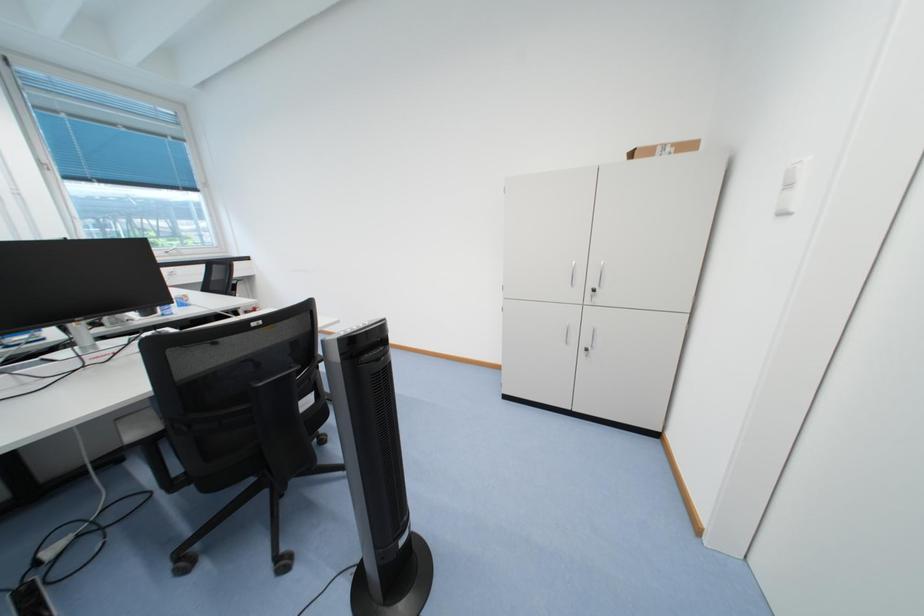
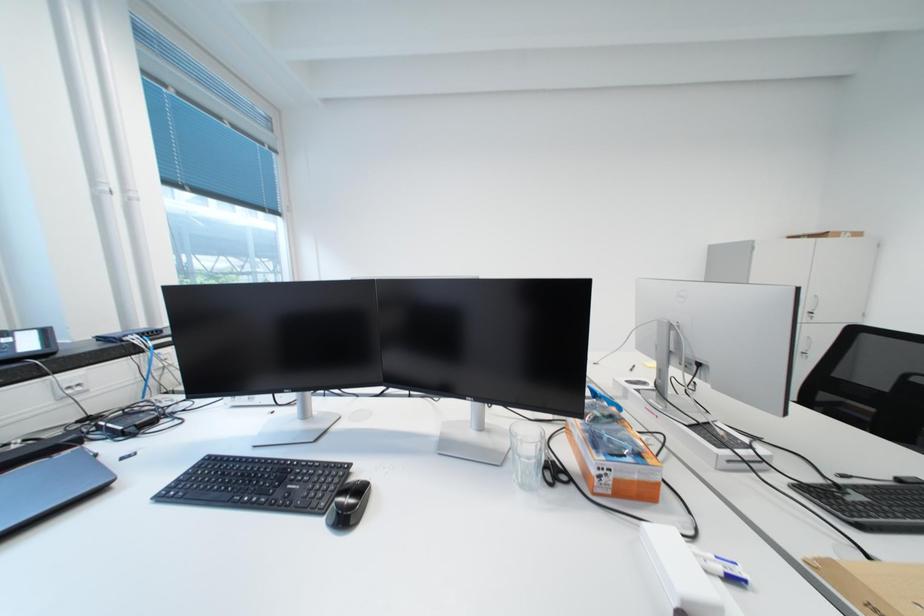
Question: The images are taken continuously from a first-person perspective. In which direction are you moving?

Choices:
 (A) Left
 (B) Right
 (C) Forward
 (D) Backward

Answer: (A)